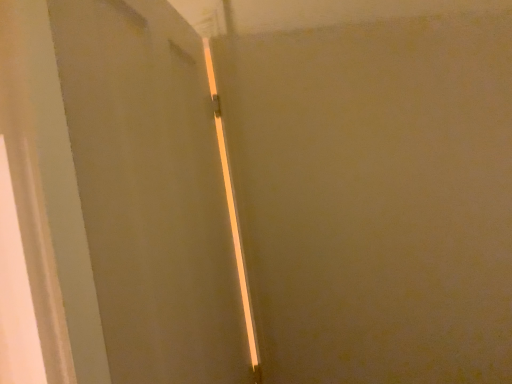
Find the location of a particular element. The height and width of the screenshot is (384, 512). matte white door at center is located at coordinates (151, 192).

Image resolution: width=512 pixels, height=384 pixels. What do you see at coordinates (151, 192) in the screenshot?
I see `matte white door at center` at bounding box center [151, 192].

The image size is (512, 384). Identify the location of matte white door at center. (151, 192).